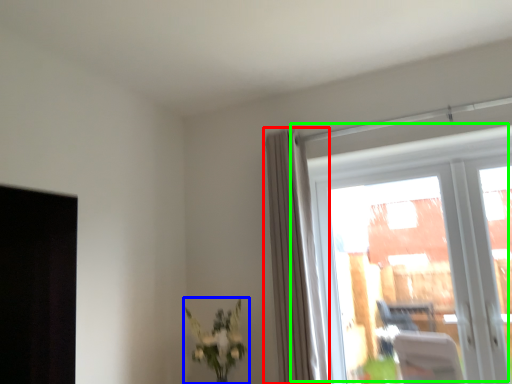
Question: Considering the real-world distances, which object is farthest from curtain (highlighted by a red box)? houseplant (highlighted by a blue box) or window (highlighted by a green box)?

Choices:
 (A) houseplant
 (B) window

Answer: (B)